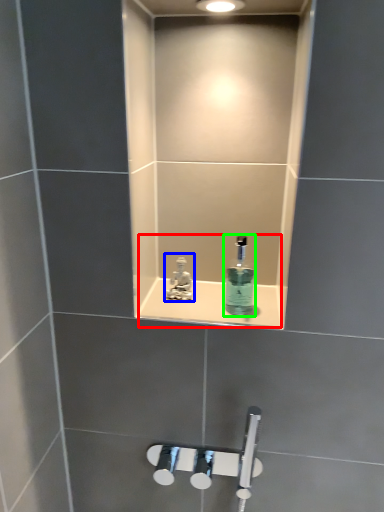
Question: Considering the real-world distances, which object is closest to sink (highlighted by a red box)? tap (highlighted by a blue box) or mouthwash (highlighted by a green box).

Choices:
 (A) tap
 (B) mouthwash

Answer: (B)